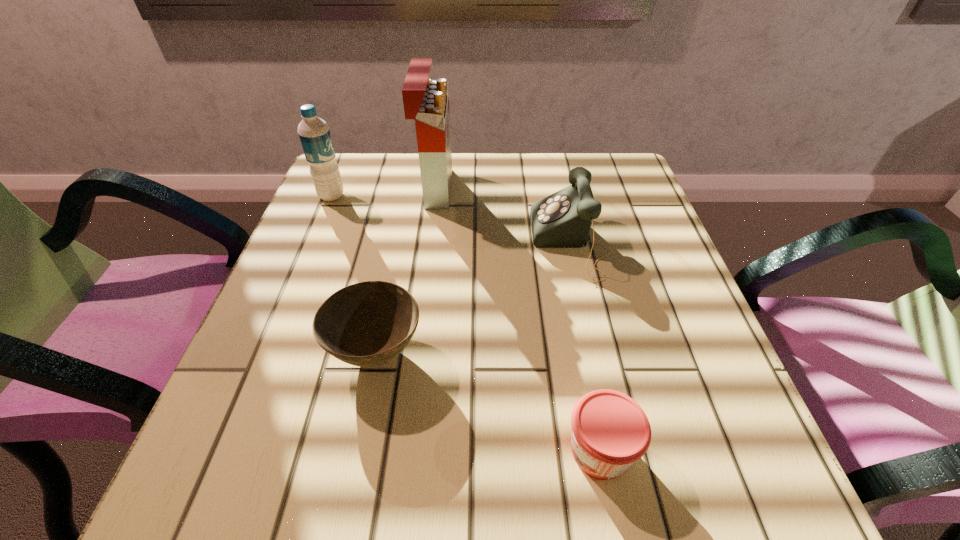
Locate an element on the screen. Image resolution: width=960 pixels, height=540 pixels. object at the right edge is located at coordinates (563, 219).

Locate an element on the screen. This screenshot has height=540, width=960. object that is at the far left corner is located at coordinates (314, 133).

In the image, there is a desktop. Where is `vacant space at the far edge`? This screenshot has width=960, height=540. vacant space at the far edge is located at coordinates (462, 156).

The height and width of the screenshot is (540, 960). In the image, there is a desktop. In order to click on vacant space at the near edge in this screenshot , I will do `click(384, 498)`.

In the image, there is a desktop. Identify the location of vacant region at the left edge. (308, 281).

The height and width of the screenshot is (540, 960). In the image, there is a desktop. What are the coordinates of `blank space at the right edge` in the screenshot? It's located at (642, 237).

In the image, there is a desktop. Identify the location of vacant space at the far right corner. This screenshot has width=960, height=540. [613, 185].

In order to click on free space at the near right corner of the desktop in this screenshot , I will do `click(680, 451)`.

Identify the location of vacant space in between the bowl and the telephone. This screenshot has width=960, height=540. (473, 298).

Identify the location of free point between the second tallest object and the tallest object. (383, 192).